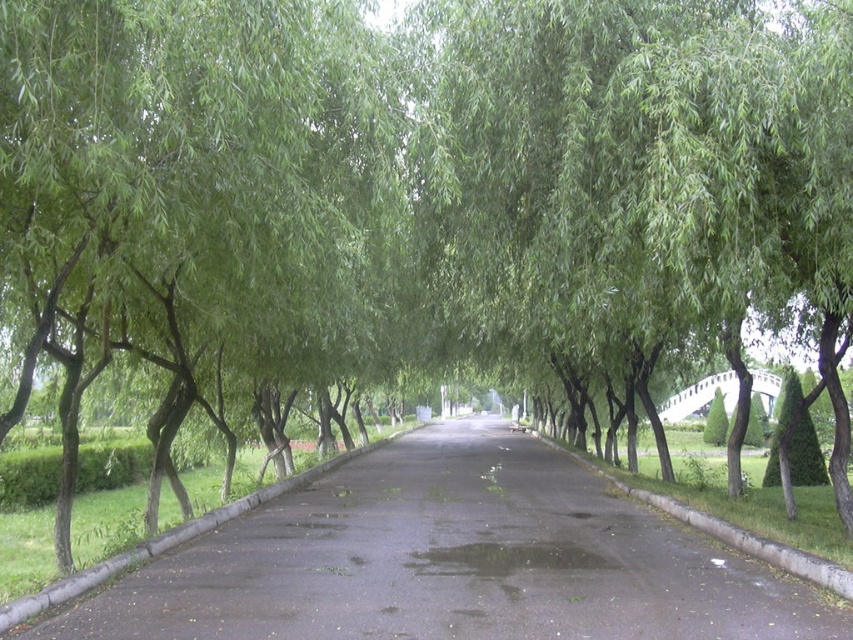
Question: Is black asphalt road at center above gray concrete curb at lower right?

Choices:
 (A) no
 (B) yes

Answer: (B)

Question: Observing the image, what is the correct spatial positioning of black asphalt road at center in reference to gray concrete curb at lower right?

Choices:
 (A) right
 (B) left

Answer: (B)

Question: Which point is farther from the camera taking this photo?

Choices:
 (A) (779, 566)
 (B) (799, 605)

Answer: (A)

Question: Can you confirm if black asphalt road at center is positioned above gray concrete curb at lower right?

Choices:
 (A) yes
 (B) no

Answer: (A)